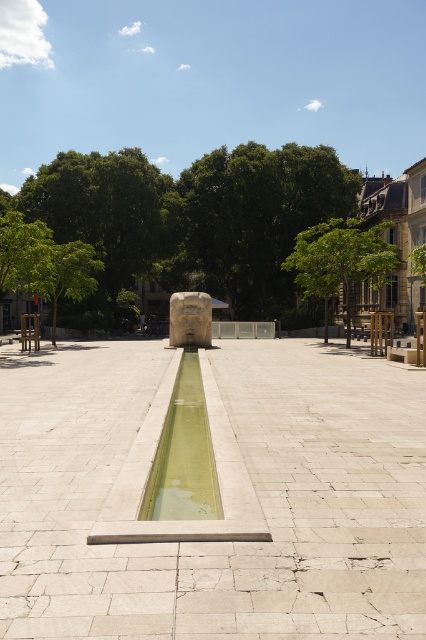
Question: Which point is closer to the camera taking this photo?

Choices:
 (A) [x=196, y=268]
 (B) [x=195, y=436]
 (C) [x=250, y=483]
 (D) [x=54, y=340]

Answer: (C)

Question: Which object is closer to the camera taking this photo?

Choices:
 (A) green leafy tree at left
 (B) green concrete water at center
 (C) green leafy tree at upper center
 (D) green leafy tree at upper right

Answer: (B)

Question: Does white stone fountain at center appear on the left side of green leafy tree at left?

Choices:
 (A) yes
 (B) no

Answer: (B)

Question: Which point is farther to the camera?

Choices:
 (A) (198, 275)
 (B) (65, 289)

Answer: (A)

Question: Is green leafy tree at center to the left of green leafy tree at upper left from the viewer's perspective?

Choices:
 (A) no
 (B) yes

Answer: (A)

Question: Is white stone fountain at center thinner than green leafy tree at left?

Choices:
 (A) no
 (B) yes

Answer: (B)